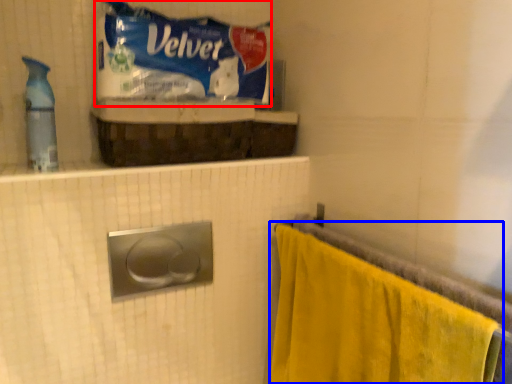
Question: Which of the following is the farthest to the observer, material (highlighted by a red box) or towel (highlighted by a blue box)?

Choices:
 (A) material
 (B) towel

Answer: (A)